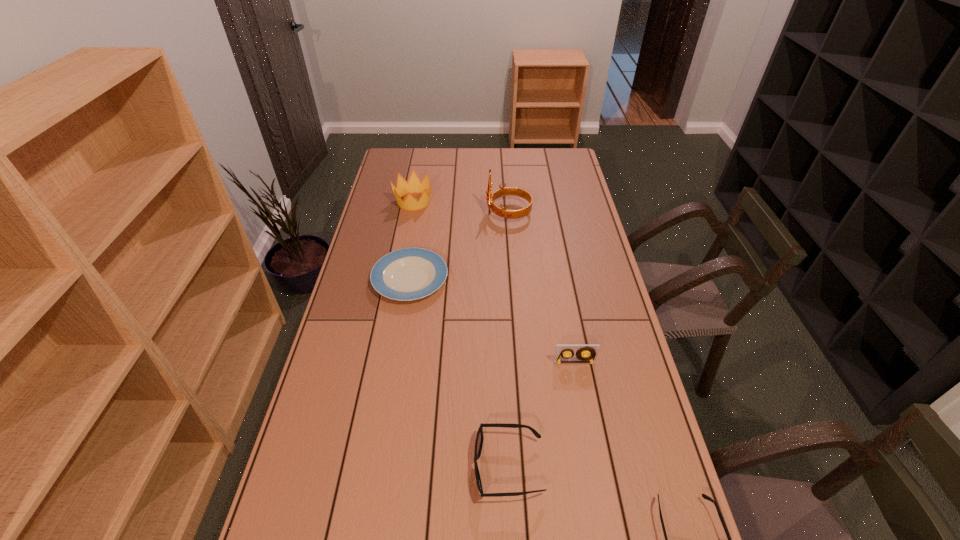
Identify the location of object that is at the right edge. (564, 353).

Where is `vacant space at the far edge`? vacant space at the far edge is located at coordinates (512, 159).

Find the location of a particular element. The width and height of the screenshot is (960, 540). free spot at the left edge of the desktop is located at coordinates (334, 371).

Find the location of a particular element. This screenshot has height=540, width=960. vacant position at the right edge of the desktop is located at coordinates (575, 195).

This screenshot has width=960, height=540. What are the coordinates of `vacant space at the near left corner of the desktop` in the screenshot? It's located at (307, 511).

Locate an element on the screen. free region at the far right corner of the desktop is located at coordinates (565, 148).

At what (x,y) coordinates should I click in order to perform the action: click on free location at the near right corner of the desktop. Please return your answer as a coordinate pair (x, y). The width and height of the screenshot is (960, 540). Looking at the image, I should click on (650, 526).

Locate an element on the screen. Image resolution: width=960 pixels, height=540 pixels. free space between the third shortest object and the fifth shortest object is located at coordinates (461, 335).

Identify the location of empty space that is in between the tallest object and the fourth farthest object. Image resolution: width=960 pixels, height=540 pixels. (541, 287).

Identify the location of empty location between the second tallest object and the left sunglasses. The width and height of the screenshot is (960, 540). (461, 335).